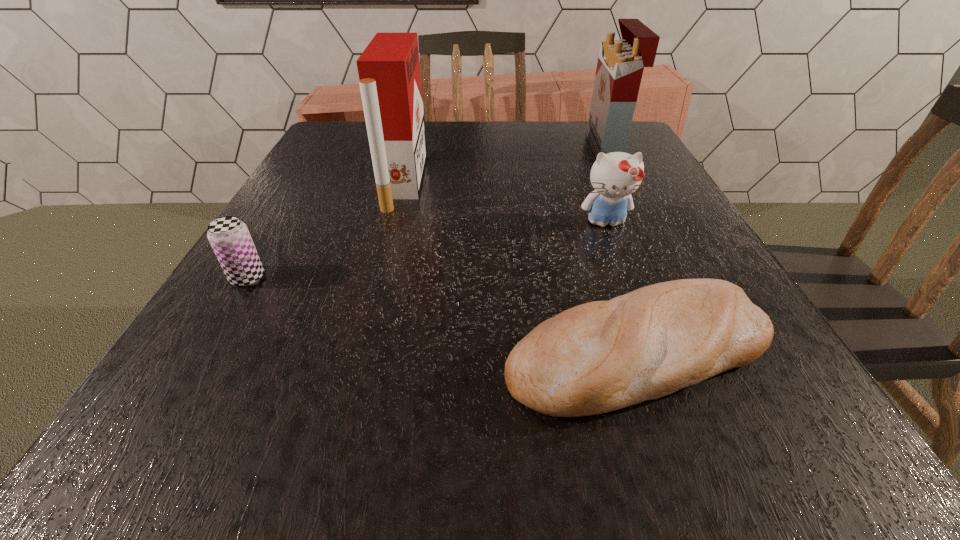
At what (x,y) coordinates should I click in order to perform the action: click on vacant space that is in between the left cigarette case and the beer can. Please return your answer as a coordinate pair (x, y). Image resolution: width=960 pixels, height=540 pixels. Looking at the image, I should click on (325, 230).

Find the location of a particular element. vacant space that is in between the shortest object and the second shortest object is located at coordinates (443, 315).

Locate an element on the screen. This screenshot has height=540, width=960. free space between the third shortest object and the left cigarette case is located at coordinates (504, 202).

Locate an element on the screen. free space between the second object from left to right and the shortest object is located at coordinates (x=520, y=267).

Locate an element on the screen. The width and height of the screenshot is (960, 540). the second closest object to the shortest object is located at coordinates (389, 73).

Identify which object is the nearest to the right cigarette case. Please provide its 2D coordinates. Your answer should be formatted as a tuple, i.e. [(x, y)], where the tuple contains the x and y coordinates of a point satisfying the conditions above.

[(615, 176)]

At what (x,y) coordinates should I click in order to perform the action: click on free spot that satisfies the following two spatial constraints: 1. on the front-facing side of the left cigarette case; 2. on the left side of the bread. Please return your answer as a coordinate pair (x, y). This screenshot has height=540, width=960. Looking at the image, I should click on (358, 352).

You are a GUI agent. You are given a task and a screenshot of the screen. Output one action in this format:
    pyautogui.click(x=<x>, y=<y>)
    Task: Click on the free space that satisfies the following two spatial constraints: 1. with the lid open on the right cigarette case; 2. on the front side of the bread
    The height and width of the screenshot is (540, 960).
    Given the screenshot: What is the action you would take?
    pyautogui.click(x=708, y=352)

Image resolution: width=960 pixels, height=540 pixels. I want to click on vacant region that satisfies the following two spatial constraints: 1. on the front-facing side of the shortest object; 2. on the left side of the second object from left to right, so click(x=358, y=352).

You are a GUI agent. You are given a task and a screenshot of the screen. Output one action in this format:
    pyautogui.click(x=<x>, y=<y>)
    Task: Click on the vacant space that satisfies the following two spatial constraints: 1. on the front-facing side of the fourth object from right to left; 2. on the front side of the second nearest object
    This screenshot has width=960, height=540.
    Given the screenshot: What is the action you would take?
    pyautogui.click(x=378, y=278)